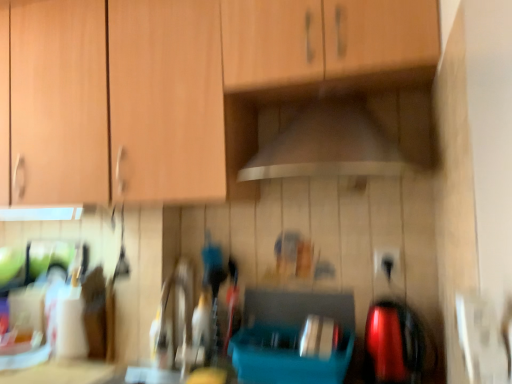
Question: Based on their sizes in the image, would you say black plastic electric outlet at lower right is bigger or smaller than wooden cabinet at upper center?

Choices:
 (A) small
 (B) big

Answer: (A)

Question: Considering their positions, is black plastic electric outlet at lower right located in front of or behind wooden cabinet at upper center?

Choices:
 (A) behind
 (B) front

Answer: (A)

Question: Which object is the closest to the black plastic electric outlet at lower right?

Choices:
 (A) wooden cabinet at upper center
 (B) white glossy countertop at lower left

Answer: (A)

Question: Which object is the farthest from the black plastic electric outlet at lower right?

Choices:
 (A) wooden cabinet at upper center
 (B) white glossy countertop at lower left

Answer: (B)